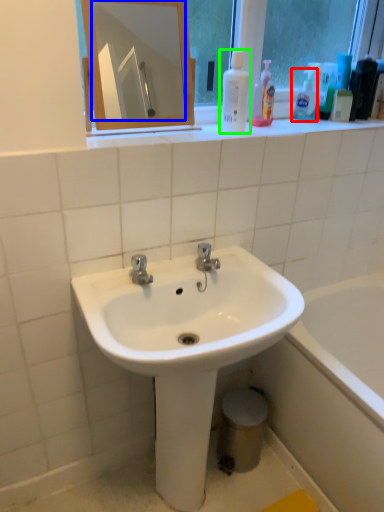
Question: Considering the real-world distances, which object is closest to cleaning product (highlighted by a red box)? mirror (highlighted by a blue box) or cleaning product (highlighted by a green box).

Choices:
 (A) mirror
 (B) cleaning product

Answer: (B)